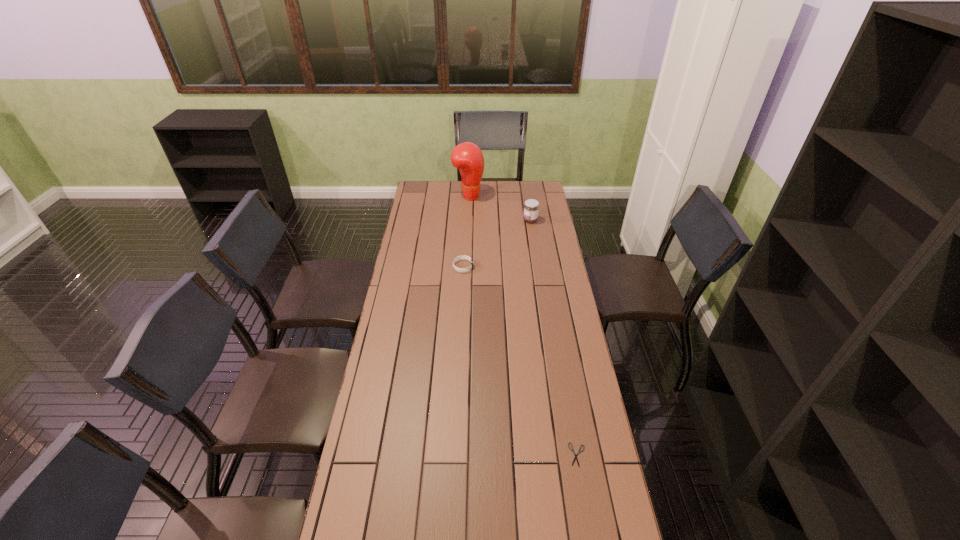
The width and height of the screenshot is (960, 540). Identify the location of vacant space at the far left corner of the desktop. (418, 194).

What are the coordinates of `free spot between the shortest object and the second nearest object` in the screenshot? It's located at (520, 361).

Locate an element on the screen. This screenshot has width=960, height=540. free space that is in between the farthest object and the shortest object is located at coordinates (523, 325).

You are a GUI agent. You are given a task and a screenshot of the screen. Output one action in this format:
    pyautogui.click(x=<x>, y=<y>)
    Task: Click on the blank region between the second shortest object and the farthest object
    
    Given the screenshot: What is the action you would take?
    pyautogui.click(x=466, y=231)

You are a GUI agent. You are given a task and a screenshot of the screen. Output one action in this format:
    pyautogui.click(x=<x>, y=<y>)
    Task: Click on the empty space that is in between the second tallest object and the boxing glove
    
    Given the screenshot: What is the action you would take?
    pyautogui.click(x=499, y=208)

Locate which object is the closest to the nearest object. Please provide its 2D coordinates. Your answer should be formatted as a tuple, i.e. [(x, y)], where the tuple contains the x and y coordinates of a point satisfying the conditions above.

[(460, 257)]

Locate which object is the third closest to the shortest object. Please provide its 2D coordinates. Your answer should be formatted as a tuple, i.e. [(x, y)], where the tuple contains the x and y coordinates of a point satisfying the conditions above.

[(467, 157)]

This screenshot has width=960, height=540. What are the coordinates of `vacant position in the image that satisfies the following two spatial constraints: 1. on the front label of the nearest object; 2. on the right side of the second tallest object` in the screenshot? It's located at coord(566,455).

At what (x,y) coordinates should I click in order to perform the action: click on free region that satisfies the following two spatial constraints: 1. on the front label of the shears; 2. on the right side of the jam. Please return your answer as a coordinate pair (x, y). Looking at the image, I should click on (566, 455).

Locate an element on the screen. The height and width of the screenshot is (540, 960). vacant region that satisfies the following two spatial constraints: 1. on the back side of the shears; 2. on the outer surface of the third farthest object is located at coordinates (545, 267).